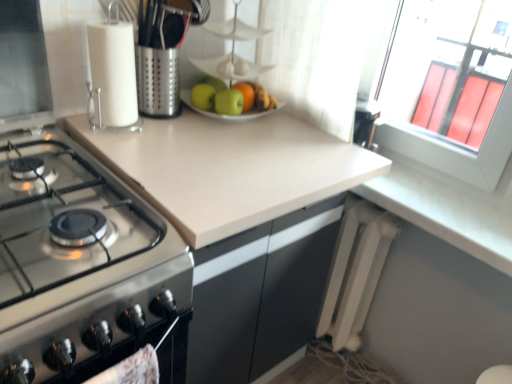
You are a GUI agent. You are given a task and a screenshot of the screen. Output one action in this format:
    pyautogui.click(x=<x>, y=<y>)
    Task: Click on the free location in front of green matte apple at center, which is the second apple in left-to-right order
    The image size is (512, 384).
    Given the screenshot: What is the action you would take?
    pyautogui.click(x=220, y=137)